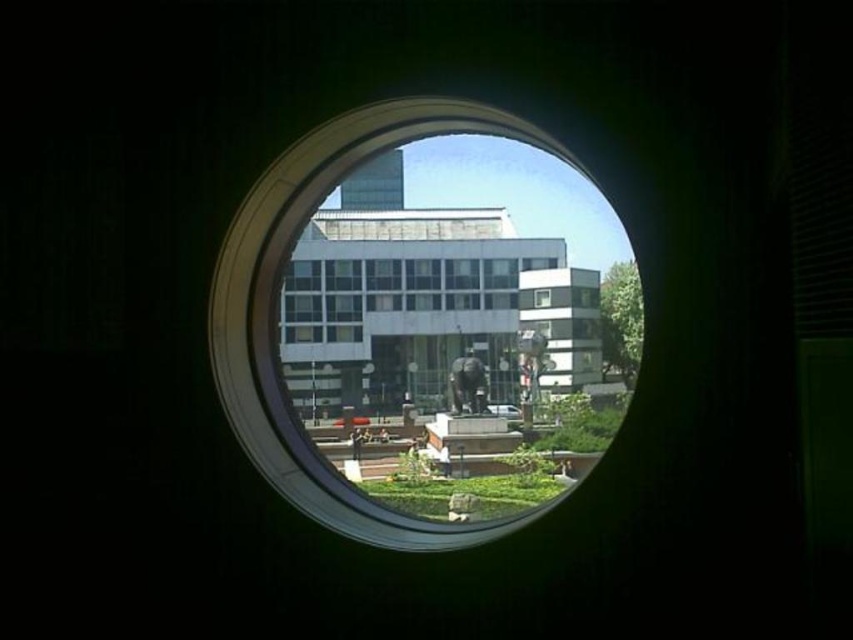
Question: Which point is closer to the camera?

Choices:
 (A) (480, 330)
 (B) (328, 493)

Answer: (B)

Question: Does transparent glass porthole at center have a smaller size compared to white glass building at center?

Choices:
 (A) no
 (B) yes

Answer: (A)

Question: Among these points, which one is nearest to the camera?

Choices:
 (A) (276, 460)
 (B) (421, 314)

Answer: (A)

Question: Can you confirm if transparent glass porthole at center is positioned to the right of white glass building at center?

Choices:
 (A) no
 (B) yes

Answer: (B)

Question: Can you confirm if transparent glass porthole at center is positioned above white glass building at center?

Choices:
 (A) no
 (B) yes

Answer: (A)

Question: Which object appears closest to the camera in this image?

Choices:
 (A) white glass building at center
 (B) transparent glass porthole at center

Answer: (B)